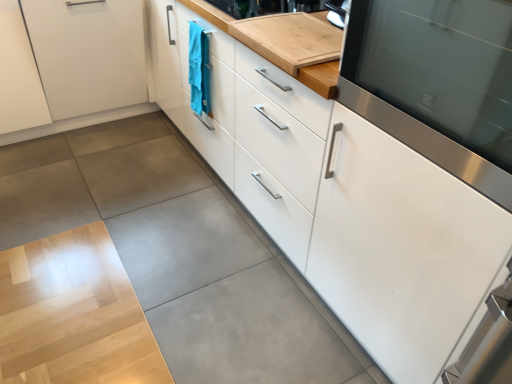
Question: In terms of height, does white glossy cabinet at center, acting as the 2th cabinetry starting from the left, look taller or shorter compared to stainless steel oven at right?

Choices:
 (A) short
 (B) tall

Answer: (B)

Question: Is white glossy cabinet at center, the second cabinetry positioned from the right, wider or thinner than stainless steel oven at right?

Choices:
 (A) thin
 (B) wide

Answer: (B)

Question: Estimate the real-world distances between objects in this image. Which object is farther from the teal fabric towel at center?

Choices:
 (A) stainless steel oven at right
 (B) white matte cabinet at lower left, which appears as the 1th cabinetry when viewed from the left
 (C) white glossy cabinet at right, marked as the third cabinetry in a left-to-right arrangement
 (D) white glossy cabinet at center, the second cabinetry positioned from the right
 (E) bamboo cutting board at upper center

Answer: (C)

Question: Which object is the farthest from the white glossy cabinet at center, the second cabinetry positioned from the right?

Choices:
 (A) bamboo cutting board at upper center
 (B) stainless steel oven at right
 (C) white matte cabinet at lower left, positioned as the 3th cabinetry in right-to-left order
 (D) teal fabric towel at center
 (E) white glossy cabinet at right, marked as the third cabinetry in a left-to-right arrangement

Answer: (C)